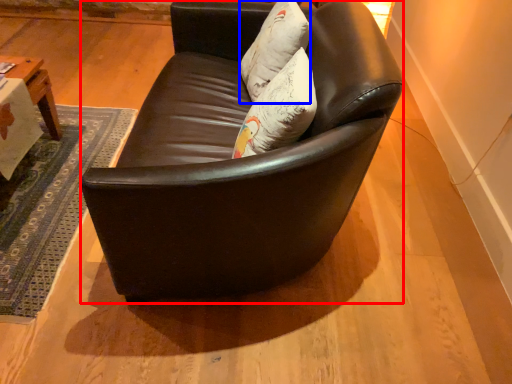
Question: Which of the following is the closest to the observer, studio couch (highlighted by a red box) or pillow (highlighted by a blue box)?

Choices:
 (A) studio couch
 (B) pillow

Answer: (A)